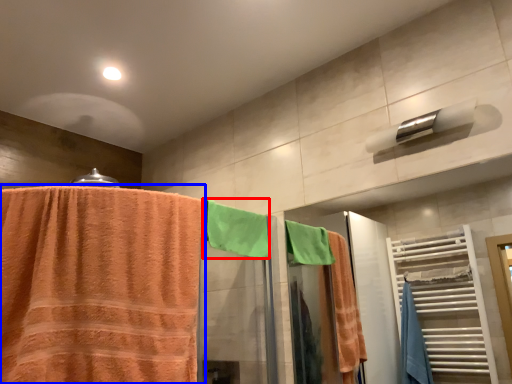
Question: Which point is further to the camera, beach towel (highlighted by a red box) or towel (highlighted by a blue box)?

Choices:
 (A) beach towel
 (B) towel

Answer: (A)